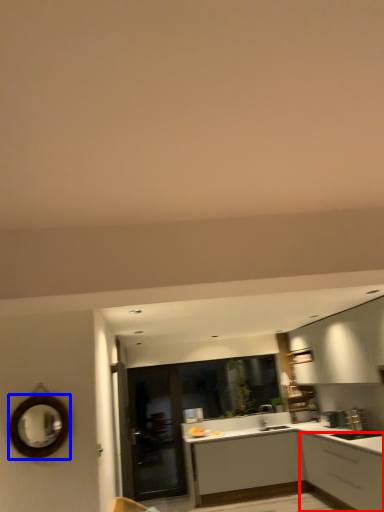
Question: Which of the following is the farthest to the observer, cabinetry (highlighted by a red box) or mirror (highlighted by a blue box)?

Choices:
 (A) cabinetry
 (B) mirror

Answer: (A)